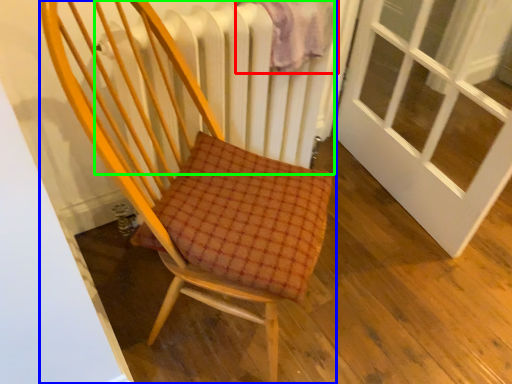
Question: Estimate the real-world distances between objects in this image. Which object is closer to blanket (highlighted by a red box), chair (highlighted by a blue box) or radiator (highlighted by a green box)?

Choices:
 (A) chair
 (B) radiator

Answer: (B)